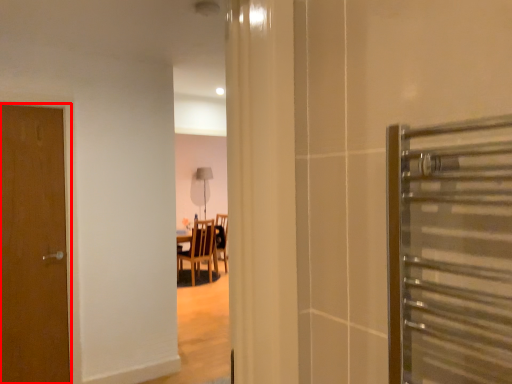
Question: In this image, where is door (annotated by the red box) located relative to chair?

Choices:
 (A) right
 (B) left

Answer: (B)